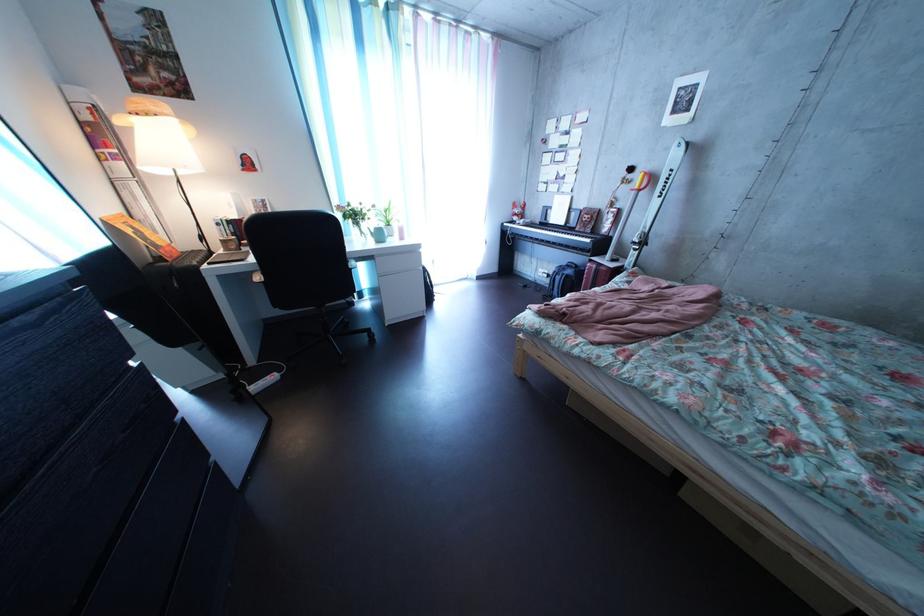
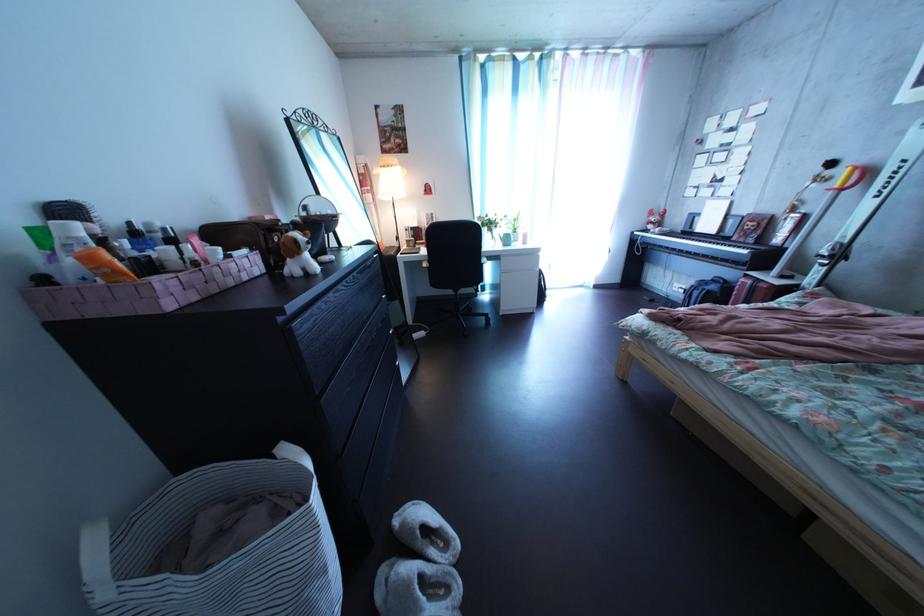
Question: The camera is either moving clockwise (left) or counter-clockwise (right) around the object. The first image is from the beginning of the video and the second image is from the end. Is the camera moving left or right when shooting the video?

Choices:
 (A) Left
 (B) Right

Answer: (B)